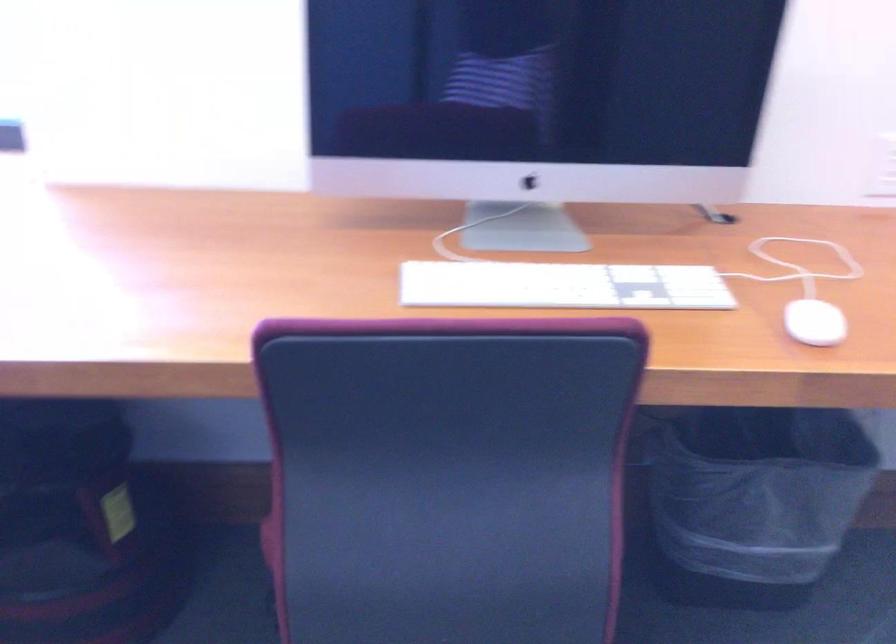
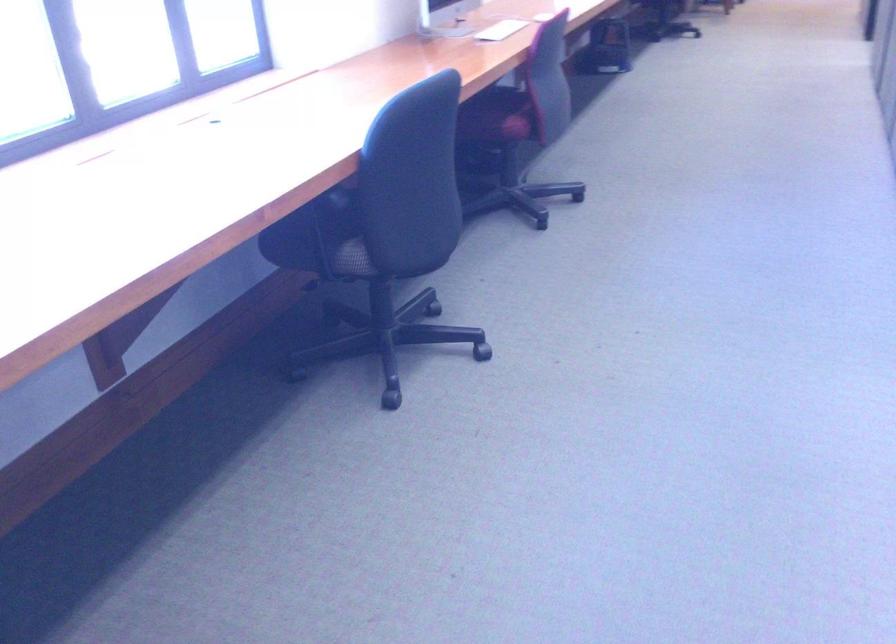
The point at (298, 494) is marked in the first image. Where is the corresponding point in the second image?

(497, 116)